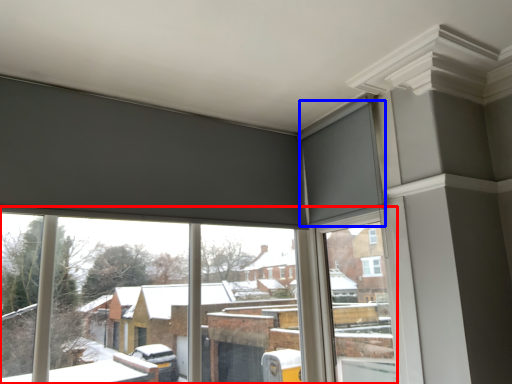
Question: Which of the following is the closest to the observer, window (highlighted by a red box) or curtain (highlighted by a blue box)?

Choices:
 (A) window
 (B) curtain

Answer: (A)